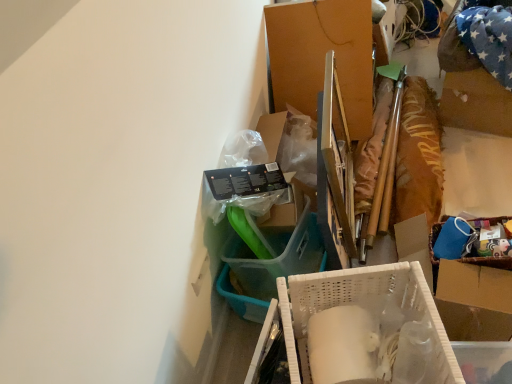
Question: Is white plastic basket at center, placed as the 2th box when sorted from top to bottom, bigger than white plastic basket at center?

Choices:
 (A) yes
 (B) no

Answer: (B)

Question: Can you confirm if white plastic basket at center, the second box positioned from the back, is smaller than white plastic basket at center?

Choices:
 (A) no
 (B) yes

Answer: (B)

Question: Considering the relative sizes of white plastic basket at center, placed as the 2th box when sorted from top to bottom, and white plastic basket at center in the image provided, is white plastic basket at center, placed as the 2th box when sorted from top to bottom, taller than white plastic basket at center?

Choices:
 (A) no
 (B) yes

Answer: (A)

Question: From the image's perspective, is white plastic basket at center, the second box positioned from the back, below white plastic basket at center?

Choices:
 (A) no
 (B) yes

Answer: (B)

Question: Does white plastic basket at center, which appears as the 1th box when ordered from the bottom, contain white plastic basket at center?

Choices:
 (A) no
 (B) yes

Answer: (A)

Question: Is point (x=309, y=274) positioned closer to the camera than point (x=284, y=49)?

Choices:
 (A) farther
 (B) closer

Answer: (B)

Question: From the image's perspective, relative to cardboard box at center, acting as the second box starting from the bottom, is white plastic basket at center, which appears as the 1th box when ordered from the bottom, above or below?

Choices:
 (A) below
 (B) above

Answer: (A)

Question: From a real-world perspective, is white plastic basket at center, the second box positioned from the back, physically located above or below cardboard box at center, acting as the 1th box starting from the back?

Choices:
 (A) above
 (B) below

Answer: (A)

Question: Is white plastic basket at center, which appears as the 1th box when ordered from the bottom, inside the boundaries of cardboard box at center, acting as the second box starting from the bottom, or outside?

Choices:
 (A) outside
 (B) inside

Answer: (A)

Question: Do you think white plastic basket at center is within cardboard box at center, acting as the 2th box starting from the front, or outside of it?

Choices:
 (A) inside
 (B) outside

Answer: (B)

Question: From the image's perspective, is white plastic basket at center located above or below cardboard box at center, acting as the second box starting from the bottom?

Choices:
 (A) above
 (B) below

Answer: (B)

Question: From a real-world perspective, relative to cardboard box at center, acting as the 2th box starting from the front, is white plastic basket at center vertically above or below?

Choices:
 (A) above
 (B) below

Answer: (A)

Question: From their relative heights in the image, would you say white plastic basket at center is taller or shorter than cardboard box at center, acting as the 1th box starting from the back?

Choices:
 (A) short
 (B) tall

Answer: (B)

Question: Does point (309, 9) appear closer or farther from the camera than point (399, 321)?

Choices:
 (A) closer
 (B) farther

Answer: (B)

Question: Is cardboard box at center, positioned as the 1th box in top-to-bottom order, inside the boundaries of white plastic basket at center, the second box positioned from the back, or outside?

Choices:
 (A) inside
 (B) outside

Answer: (B)